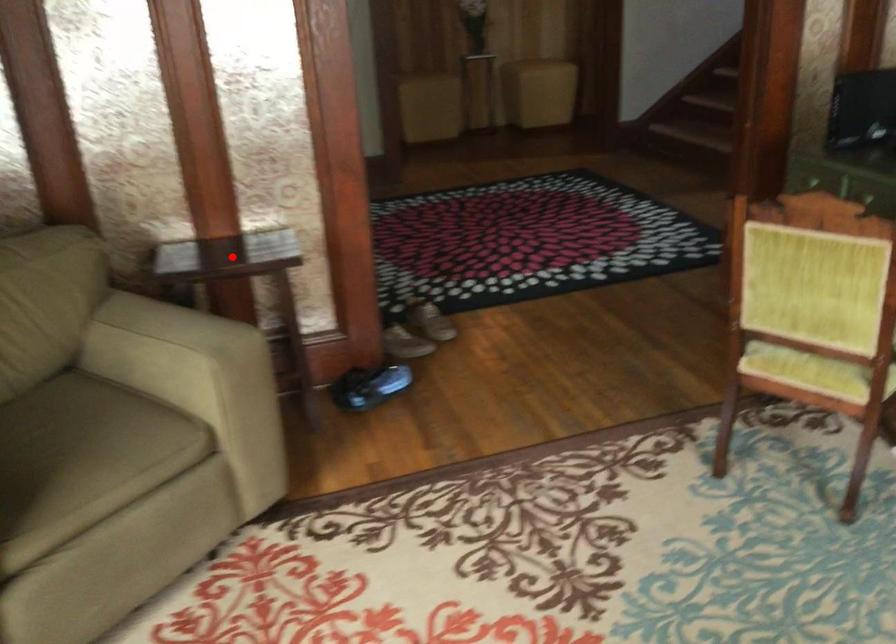
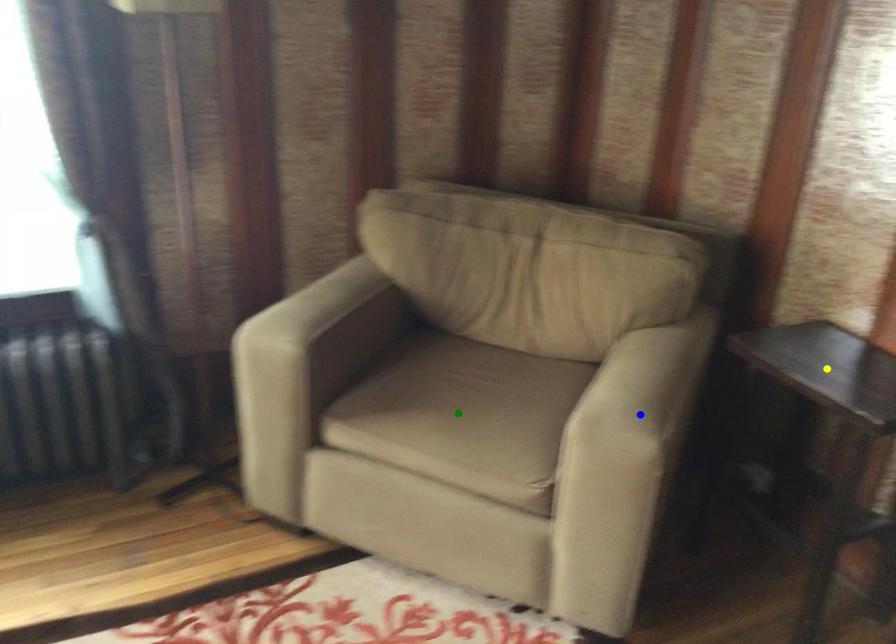
Question: I am providing you with two images of the same scene from different viewpoints. A red point is marked on the first image. You are given multiple points on the second image. Can you choose the point in image 2 that corresponds to the point in image 1?

Choices:
 (A) green point
 (B) blue point
 (C) yellow point

Answer: (C)